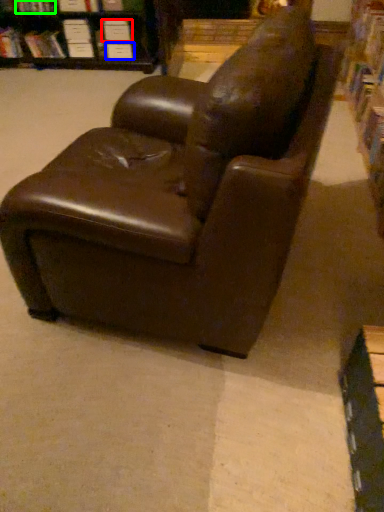
Question: Based on their relative distances, which object is nearer to paperback book (highlighted by a red box)? Choose from paperback book (highlighted by a blue box) and book (highlighted by a green box).

Choices:
 (A) paperback book
 (B) book

Answer: (A)